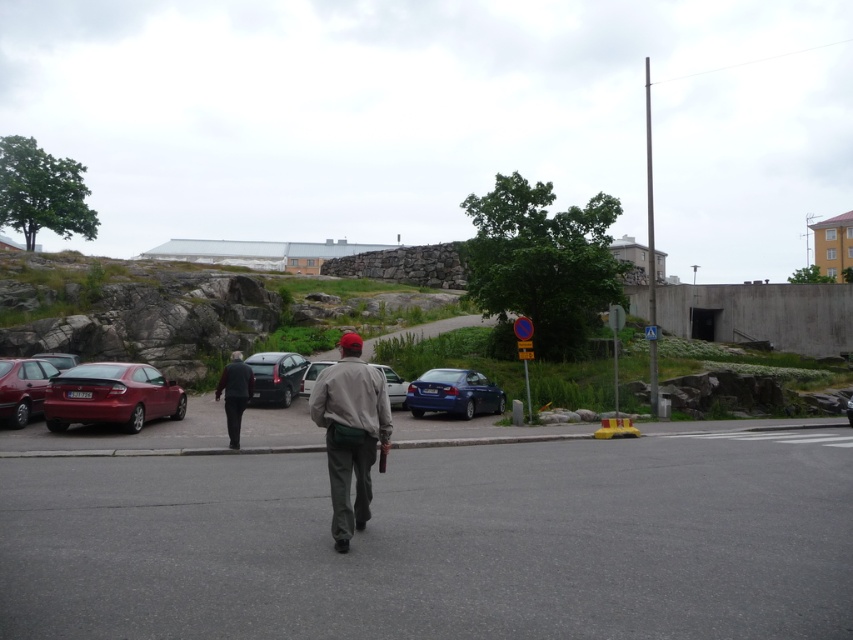
Is matte blue sedan at center to the right of dark gray fabric pants at center from the viewer's perspective?

Indeed, matte blue sedan at center is positioned on the right side of dark gray fabric pants at center.

Does matte blue sedan at center appear over dark gray fabric pants at center?

No, matte blue sedan at center is not above dark gray fabric pants at center.

Locate an element on the screen. matte blue sedan at center is located at coordinates (453, 394).

Where is `matte blue sedan at center`? This screenshot has height=640, width=853. matte blue sedan at center is located at coordinates (453, 394).

Between shiny red car at left and matte blue sedan at center, which one has more height?

With more height is shiny red car at left.

Based on the photo, does shiny red car at left appear on the left side of matte blue sedan at center?

Indeed, shiny red car at left is positioned on the left side of matte blue sedan at center.

Is point (65, 378) positioned after point (405, 392)?

No.

Find the location of a particular element. shiny red car at left is located at coordinates (111, 396).

Can you confirm if gray fabric jacket at center is thinner than matte red car at left?

Incorrect, gray fabric jacket at center's width is not less than matte red car at left's.

Is point (347, 451) positioned after point (76, 358)?

No, (347, 451) is in front of (76, 358).

Find the location of `gray fabric jacket at center`. gray fabric jacket at center is located at coordinates (350, 433).